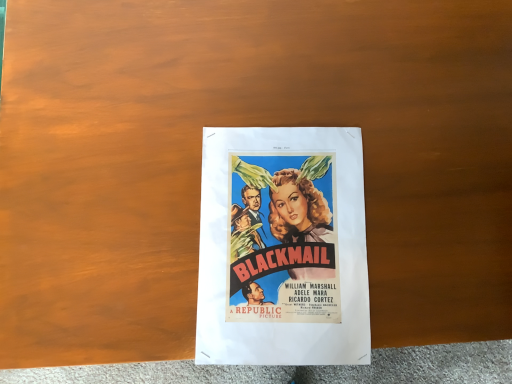
Question: Should I look upward or downward to see matte paper poster at center?

Choices:
 (A) down
 (B) up

Answer: (A)